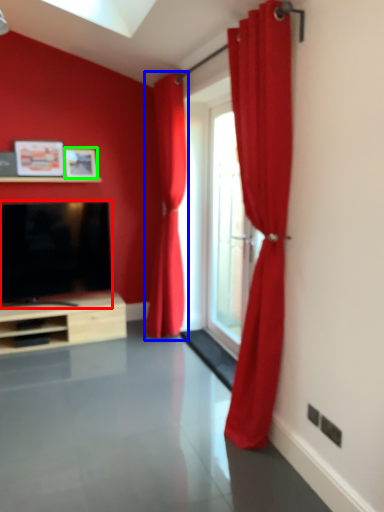
Question: Based on their relative distances, which object is nearer to television (highlighted by a red box)? Choose from curtain (highlighted by a blue box) and picture frame (highlighted by a green box).

Choices:
 (A) curtain
 (B) picture frame

Answer: (B)